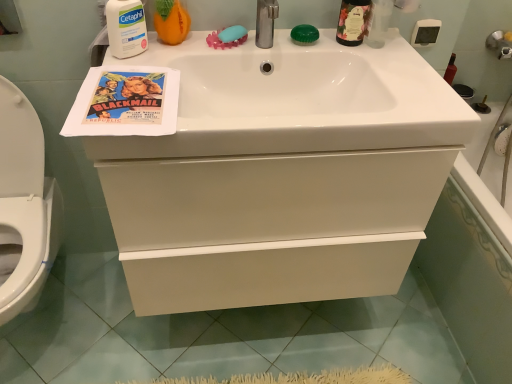
The height and width of the screenshot is (384, 512). I want to click on empty space that is to the right of white matte cetaphil at upper left, which appears as the second cleaning product when viewed from the right, so click(x=178, y=52).